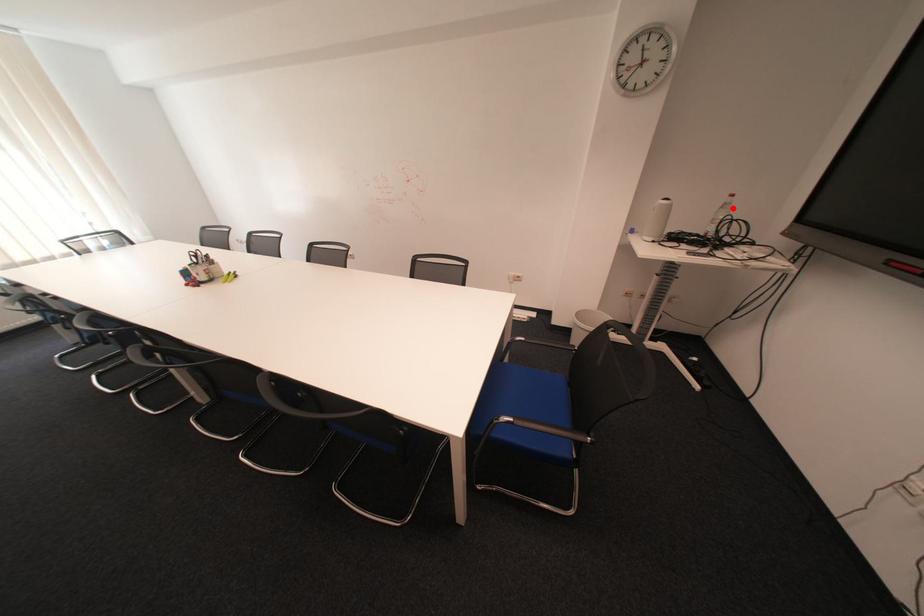
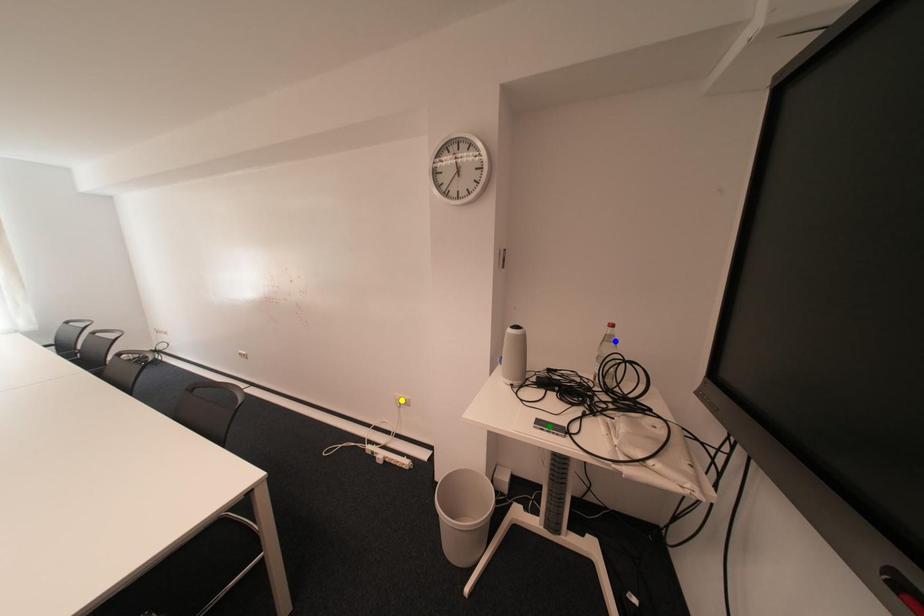
Question: I am providing you with two images of the same scene from different viewpoints. A red point is marked on the first image. You are given multiple points on the second image. Which point in image 2 represents the same 3d spot as the red point in image 1?

Choices:
 (A) green point
 (B) yellow point
 (C) blue point

Answer: (C)